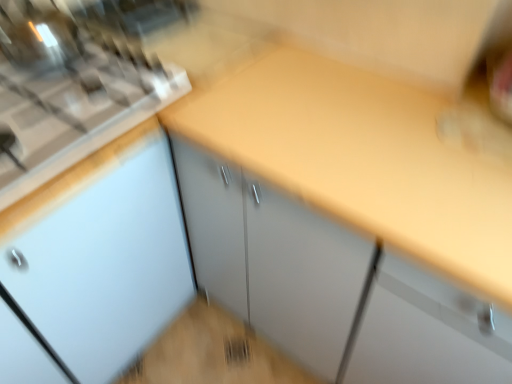
What do you see at coordinates (74, 75) in the screenshot?
I see `satin silver gas stove at upper left` at bounding box center [74, 75].

Where is `satin silver gas stove at upper left`? satin silver gas stove at upper left is located at coordinates (74, 75).

This screenshot has height=384, width=512. What are the coordinates of `yellow laminate countertop at center` in the screenshot? It's located at (362, 157).

The width and height of the screenshot is (512, 384). What do you see at coordinates (362, 157) in the screenshot?
I see `yellow laminate countertop at center` at bounding box center [362, 157].

Locate an element on the screen. satin silver gas stove at upper left is located at coordinates coord(74,75).

Does yellow laminate countertop at center appear on the right side of satin silver gas stove at upper left?

Yes, yellow laminate countertop at center is to the right of satin silver gas stove at upper left.

Which object is more forward, yellow laminate countertop at center or satin silver gas stove at upper left?

Positioned in front is yellow laminate countertop at center.

Does point (509, 202) come farther from viewer compared to point (45, 66)?

No.

From the image's perspective, is yellow laminate countertop at center located above or below satin silver gas stove at upper left?

Clearly, from the image's perspective, yellow laminate countertop at center is below satin silver gas stove at upper left.

Consider the image. From a real-world perspective, who is located lower, yellow laminate countertop at center or satin silver gas stove at upper left?

yellow laminate countertop at center.

Considering the relative sizes of yellow laminate countertop at center and satin silver gas stove at upper left in the image provided, is yellow laminate countertop at center wider than satin silver gas stove at upper left?

Indeed, yellow laminate countertop at center has a greater width compared to satin silver gas stove at upper left.

Which of these two, yellow laminate countertop at center or satin silver gas stove at upper left, stands shorter?

With less height is satin silver gas stove at upper left.

Does yellow laminate countertop at center have a smaller size compared to satin silver gas stove at upper left?

No.

Is yellow laminate countertop at center located outside satin silver gas stove at upper left?

Indeed, yellow laminate countertop at center is completely outside satin silver gas stove at upper left.

Is yellow laminate countertop at center not near satin silver gas stove at upper left?

They are positioned close to each other.

Is satin silver gas stove at upper left at the back of yellow laminate countertop at center?

That's not correct — yellow laminate countertop at center is not looking away from satin silver gas stove at upper left.

How many degrees apart are the facing directions of yellow laminate countertop at center and satin silver gas stove at upper left?

The facing directions of yellow laminate countertop at center and satin silver gas stove at upper left are 91.1 degrees apart.

Measure the distance between yellow laminate countertop at center and satin silver gas stove at upper left.

15.23 inches.

Identify the location of countertop that is on the right side of satin silver gas stove at upper left. This screenshot has width=512, height=384. (362, 157).

Considering the positions of objects satin silver gas stove at upper left and yellow laminate countertop at center in the image provided, who is more to the left, satin silver gas stove at upper left or yellow laminate countertop at center?

satin silver gas stove at upper left.

Is satin silver gas stove at upper left further to camera compared to yellow laminate countertop at center?

Yes, it is behind yellow laminate countertop at center.

Is point (0, 192) less distant than point (325, 73)?

Yes.

From the image's perspective, which is above, satin silver gas stove at upper left or yellow laminate countertop at center?

satin silver gas stove at upper left, from the image's perspective.

From a real-world perspective, is satin silver gas stove at upper left beneath yellow laminate countertop at center?

No, from a real-world perspective, satin silver gas stove at upper left is not under yellow laminate countertop at center.

Is satin silver gas stove at upper left thinner than yellow laminate countertop at center?

Indeed, satin silver gas stove at upper left has a lesser width compared to yellow laminate countertop at center.

Can you confirm if satin silver gas stove at upper left is shorter than yellow laminate countertop at center?

Correct, satin silver gas stove at upper left is not as tall as yellow laminate countertop at center.

Can you confirm if satin silver gas stove at upper left is bigger than yellow laminate countertop at center?

No, satin silver gas stove at upper left is not bigger than yellow laminate countertop at center.

Is satin silver gas stove at upper left not inside yellow laminate countertop at center?

Yes, satin silver gas stove at upper left is located beyond the bounds of yellow laminate countertop at center.

Are satin silver gas stove at upper left and yellow laminate countertop at center beside each other?

No, satin silver gas stove at upper left is not in contact with yellow laminate countertop at center.

Does satin silver gas stove at upper left turn towards yellow laminate countertop at center?

No, satin silver gas stove at upper left does not turn towards yellow laminate countertop at center.

You are a GUI agent. You are given a task and a screenshot of the screen. Output one action in this format:
    pyautogui.click(x=<x>, y=<y>)
    Task: Click on the gas stove lying above the yellow laminate countertop at center (from the image's perspective)
    The height and width of the screenshot is (384, 512).
    Given the screenshot: What is the action you would take?
    pyautogui.click(x=74, y=75)

This screenshot has width=512, height=384. I want to click on gas stove to the left of yellow laminate countertop at center, so 74,75.

At what (x,y) coordinates should I click in order to perform the action: click on countertop below the satin silver gas stove at upper left (from the image's perspective). Please return your answer as a coordinate pair (x, y). This screenshot has height=384, width=512. Looking at the image, I should click on (362, 157).